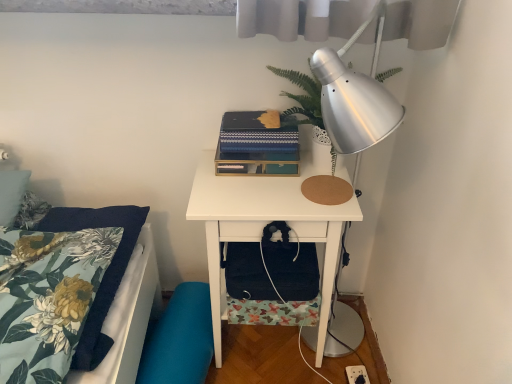
Question: Is teal fabric swivel chair at lower left wider than blue textured book at center?

Choices:
 (A) yes
 (B) no

Answer: (A)

Question: Does teal fabric swivel chair at lower left have a greater height compared to blue textured book at center?

Choices:
 (A) yes
 (B) no

Answer: (A)

Question: Is teal fabric swivel chair at lower left positioned beyond the bounds of blue textured book at center?

Choices:
 (A) yes
 (B) no

Answer: (A)

Question: From a real-world perspective, is teal fabric swivel chair at lower left positioned under blue textured book at center based on gravity?

Choices:
 (A) no
 (B) yes

Answer: (B)

Question: Does teal fabric swivel chair at lower left appear on the left side of blue textured book at center?

Choices:
 (A) no
 (B) yes

Answer: (B)

Question: Is teal fabric swivel chair at lower left in front of or behind white plastic electric outlet at lower right in the image?

Choices:
 (A) behind
 (B) front

Answer: (B)

Question: Is teal fabric swivel chair at lower left inside or outside of white plastic electric outlet at lower right?

Choices:
 (A) inside
 (B) outside

Answer: (B)

Question: Considering the positions of teal fabric swivel chair at lower left and white plastic electric outlet at lower right in the image, is teal fabric swivel chair at lower left wider or thinner than white plastic electric outlet at lower right?

Choices:
 (A) thin
 (B) wide

Answer: (A)

Question: Based on their positions, is teal fabric swivel chair at lower left located to the left or right of white plastic electric outlet at lower right?

Choices:
 (A) left
 (B) right

Answer: (A)

Question: From a real-world perspective, is black fabric bag at lower center positioned above or below floral fabric pillow at left?

Choices:
 (A) above
 (B) below

Answer: (B)

Question: Looking at their shapes, would you say black fabric bag at lower center is wider or thinner than floral fabric pillow at left?

Choices:
 (A) thin
 (B) wide

Answer: (A)

Question: Visually, is black fabric bag at lower center positioned to the left or to the right of floral fabric pillow at left?

Choices:
 (A) right
 (B) left

Answer: (A)

Question: From the image's perspective, is black fabric bag at lower center located above or below floral fabric pillow at left?

Choices:
 (A) below
 (B) above

Answer: (B)

Question: Considering the positions of point (220, 135) and point (196, 289), is point (220, 135) closer or farther from the camera than point (196, 289)?

Choices:
 (A) closer
 (B) farther

Answer: (A)

Question: Relative to teal fabric swivel chair at lower left, is blue textured book at center in front or behind?

Choices:
 (A) behind
 (B) front

Answer: (B)